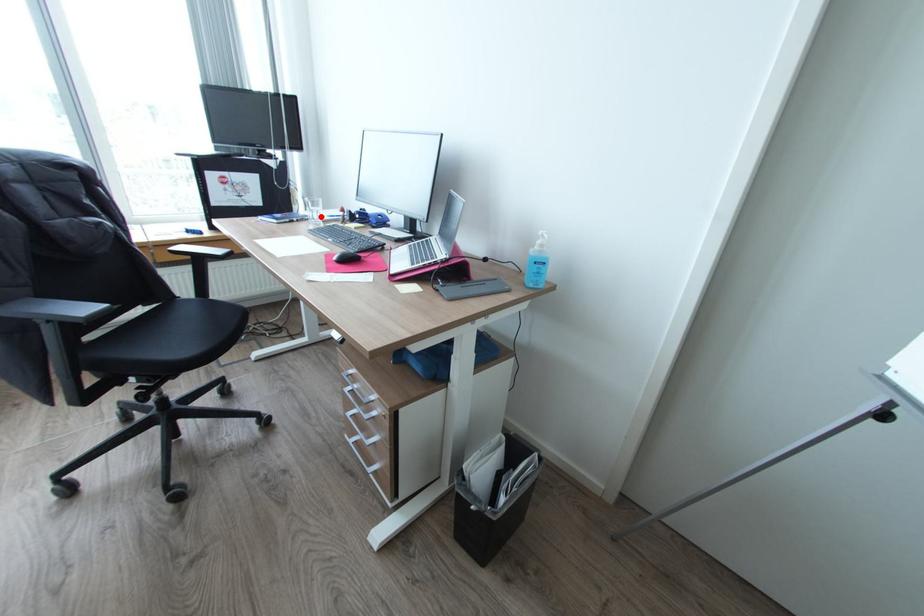
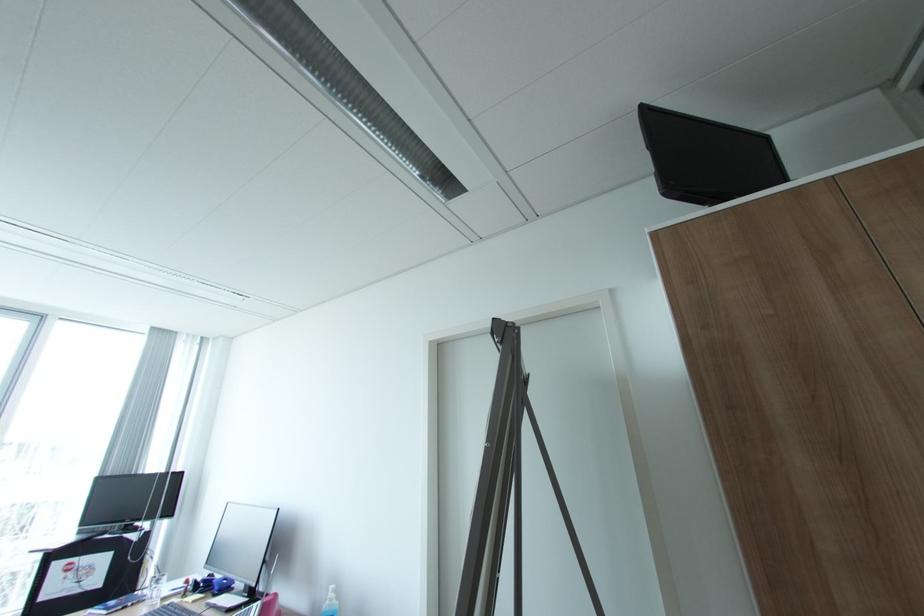
Find the pixel in the second image that matches the highlighted location in the first image.

(160, 596)